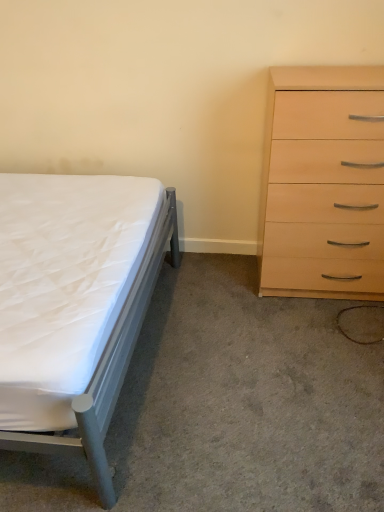
Question: Is white fabric bed at left to the right of light wood/finish chest of drawers at right from the viewer's perspective?

Choices:
 (A) no
 (B) yes

Answer: (A)

Question: Are white fabric bed at left and light wood/finish chest of drawers at right beside each other?

Choices:
 (A) no
 (B) yes

Answer: (A)

Question: Is light wood/finish chest of drawers at right at the back of white fabric bed at left?

Choices:
 (A) yes
 (B) no

Answer: (B)

Question: Is white fabric bed at left not inside light wood/finish chest of drawers at right?

Choices:
 (A) no
 (B) yes

Answer: (B)

Question: Can you confirm if white fabric bed at left is taller than light wood/finish chest of drawers at right?

Choices:
 (A) no
 (B) yes

Answer: (A)

Question: Can you confirm if white fabric bed at left is positioned to the left of light wood/finish chest of drawers at right?

Choices:
 (A) no
 (B) yes

Answer: (B)

Question: Can you confirm if light wood/finish chest of drawers at right is shorter than white fabric bed at left?

Choices:
 (A) no
 (B) yes

Answer: (A)

Question: Does light wood/finish chest of drawers at right have a greater width compared to white fabric bed at left?

Choices:
 (A) no
 (B) yes

Answer: (A)

Question: From a real-world perspective, is light wood/finish chest of drawers at right physically below white fabric bed at left?

Choices:
 (A) yes
 (B) no

Answer: (B)

Question: Is light wood/finish chest of drawers at right bigger than white fabric bed at left?

Choices:
 (A) no
 (B) yes

Answer: (B)

Question: Is light wood/finish chest of drawers at right to the left of white fabric bed at left from the viewer's perspective?

Choices:
 (A) no
 (B) yes

Answer: (A)

Question: Is white fabric bed at left inside light wood/finish chest of drawers at right?

Choices:
 (A) no
 (B) yes

Answer: (A)

Question: Is white matte bed at left at the left side of white fabric bed at left?

Choices:
 (A) yes
 (B) no

Answer: (A)